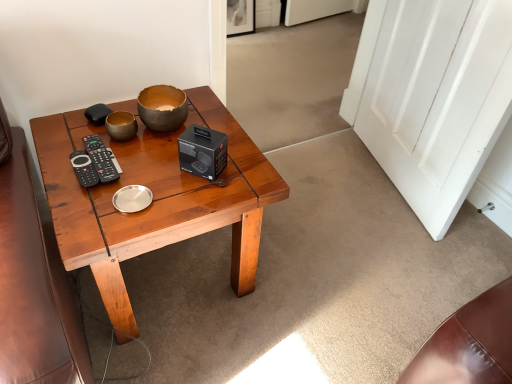
Question: Considering the positions of white glossy door at right and matte brown bowl at center in the image, is white glossy door at right bigger or smaller than matte brown bowl at center?

Choices:
 (A) small
 (B) big

Answer: (B)

Question: In the image, is white glossy door at right on the left side or the right side of matte brown bowl at center?

Choices:
 (A) left
 (B) right

Answer: (B)

Question: Which object is the closest to the black plastic remote at left?

Choices:
 (A) matte brown bowl at center
 (B) wooden coffee table at center
 (C) white glossy door at right

Answer: (A)

Question: Which is nearer to the matte brown bowl at center?

Choices:
 (A) wooden coffee table at center
 (B) black plastic remote at left
 (C) white glossy door at right

Answer: (B)